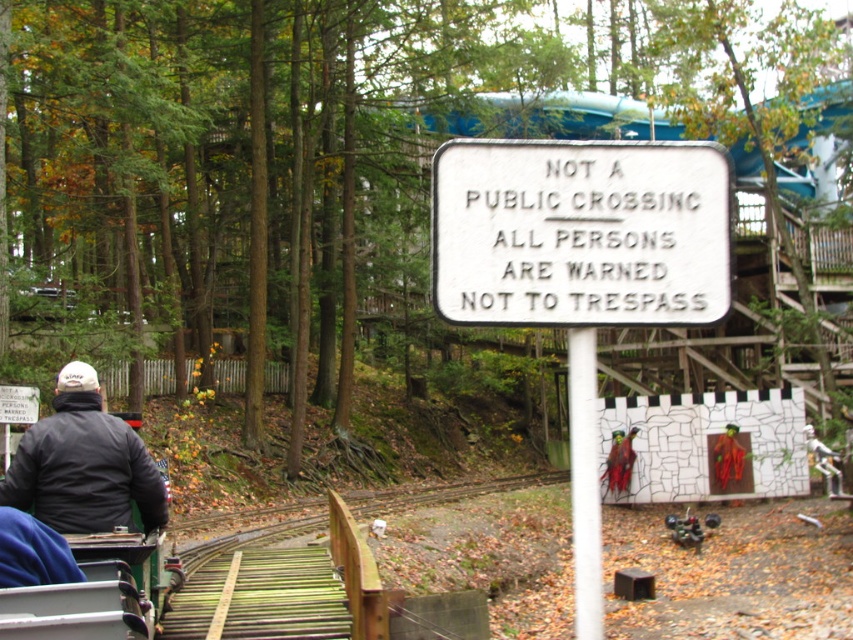
Looking at this image, you are a park visitor who wants to read both signs clearly. Which sign, the white paper sign at center or the white plastic sign at center, is easier to read from a distance?

The white plastic sign at center is thicker than the white paper sign at center, so it is easier to read from a distance.

You are a hiker who just arrived at the forest area and see the point marked at coordinate (579, 268). What object is located at that point?

The point at coordinate (579, 268) marks the white paper sign at center.